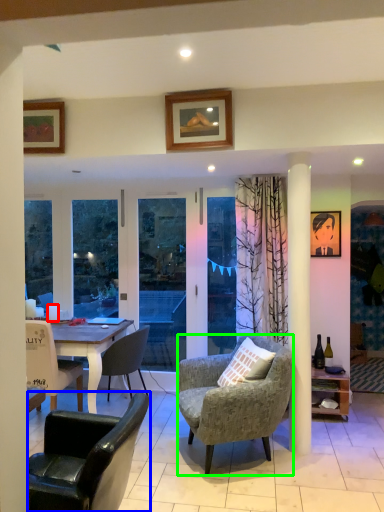
Question: Which is nearer to the coffee cup (highlighted by a red box)? chair (highlighted by a blue box) or chair (highlighted by a green box).

Choices:
 (A) chair
 (B) chair

Answer: (B)